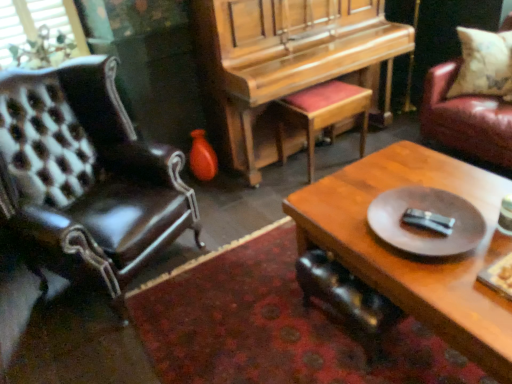
This screenshot has width=512, height=384. I want to click on space that is in front of leather chair at left, which is counted as the 1th chair, starting from the left, so click(x=121, y=349).